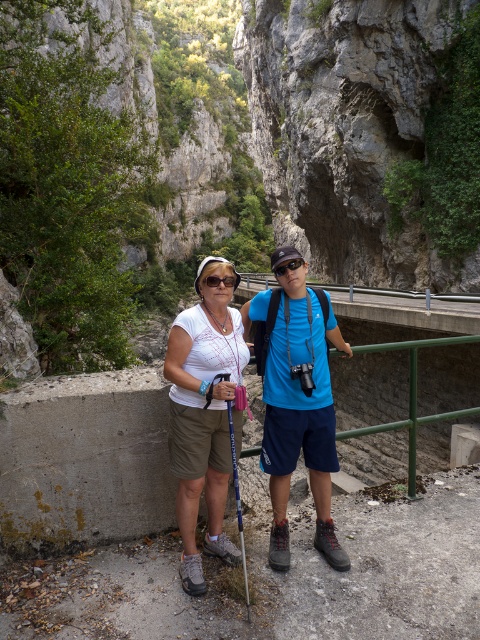
Between concrete path at lower center and blue fabric shirt at center, which one appears on the right side from the viewer's perspective?

concrete path at lower center

Where is `concrete path at lower center`? This screenshot has width=480, height=640. concrete path at lower center is located at coordinates (275, 579).

Does blue fabric shirt at center have a greater width compared to black matte sunglasses at center?

Yes.

Where is `blue fabric shirt at center`? The width and height of the screenshot is (480, 640). blue fabric shirt at center is located at coordinates (298, 404).

Who is taller, concrete path at lower center or black matte sunglasses at center?

concrete path at lower center is taller.

Is concrete path at lower center positioned before black matte sunglasses at center?

Yes, it is in front of black matte sunglasses at center.

The width and height of the screenshot is (480, 640). I want to click on concrete path at lower center, so tap(275, 579).

Identify the location of concrete path at lower center. The width and height of the screenshot is (480, 640). (275, 579).